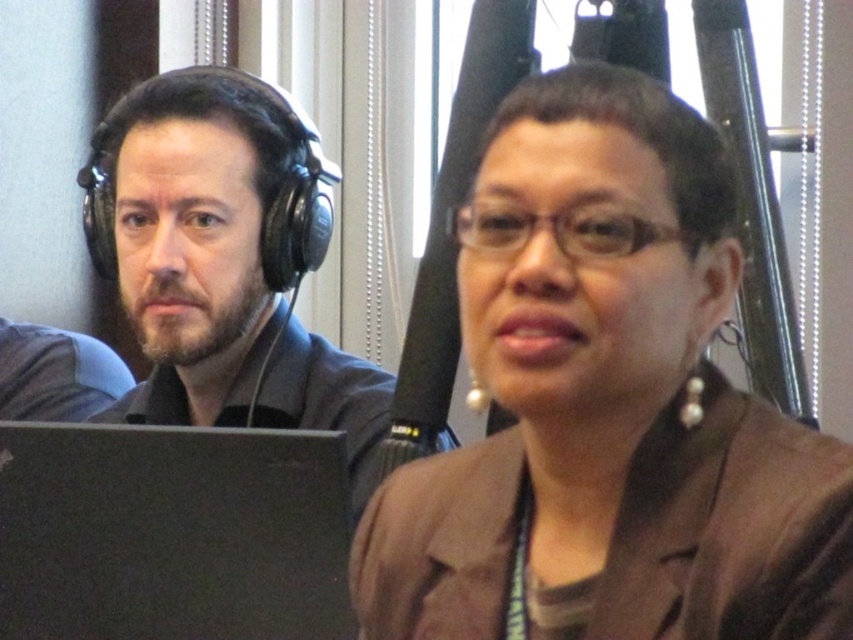
You are organizing a meeting and need to place a name tag on the table. The name tag is 10 cm wide. There is a brown fabric jacket at center and a black matte laptop at lower left. Can the name tag fit between them?

The brown fabric jacket at center is to the right of the black matte laptop at lower left, so the space between them is available. Since the name tag is 10 cm wide, you need to check the distance between the two objects. However, the exact distance isn not provided in the description, so it is uncertain if the name tag will fit.

You are a delivery person who needs to place a small package on the table between the brown fabric jacket at center and the black matte laptop at lower left. The package requires at least 12 inches of space. Can you fit it there?

The brown fabric jacket at center is 15.77 inches from the black matte laptop at lower left, which is more than the required 12 inches. Therefore, the package can be placed there.